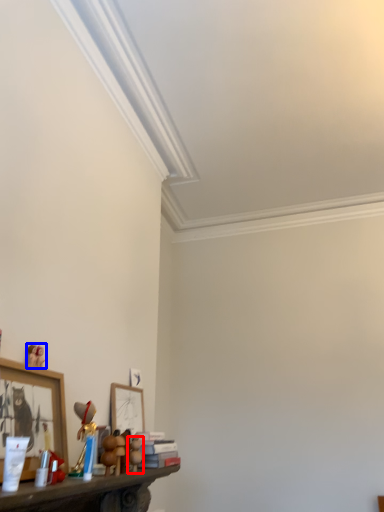
Question: Among these objects, which one is nearest to the camera, toy (highlighted by a red box) or toy (highlighted by a blue box)?

Choices:
 (A) toy
 (B) toy

Answer: (B)